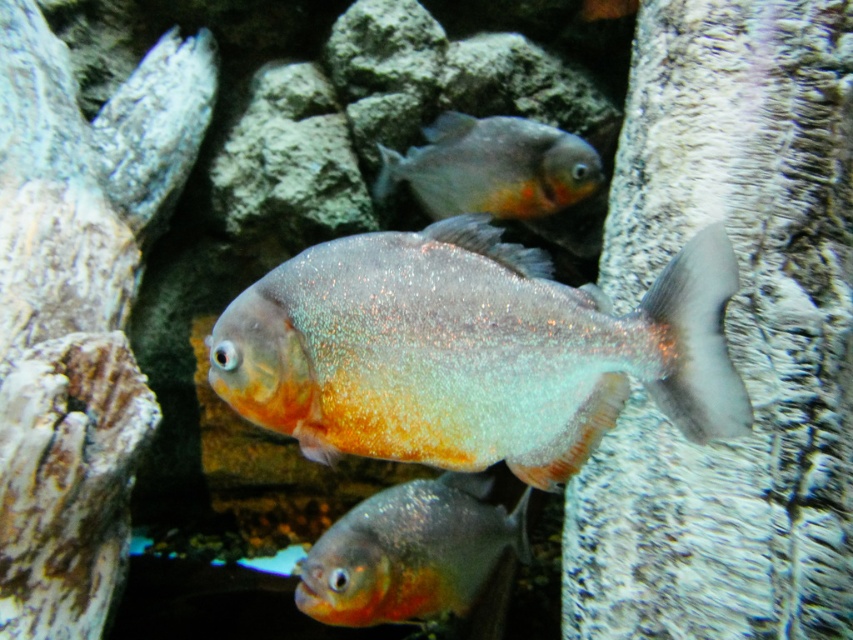
You are an underwater photographer aiming to capture the shiny metallic fish at center. Based on its position, which direction should you adjust your camera to focus on it?

The shiny metallic fish at center is located at point coordinates, so you should adjust your camera towards the center of the scene to focus on it.

You are a marine biologist observing the underwater scene. You notice two fish, the shiny metallic fish at center and the shiny orange fish at upper center. Which fish is positioned lower in the water?

The shiny metallic fish at center is positioned lower than the shiny orange fish at upper center.

You are a diver who wants to place a marker between the two points, point (x=379, y=340) and point (x=363, y=528). Which point should you place the marker closer to so that it is in front of the other point?

You should place the marker closer to point (x=363, y=528) because point (x=379, y=340) is in front of point (x=363, y=528), so placing it near the latter will keep it behind the former.